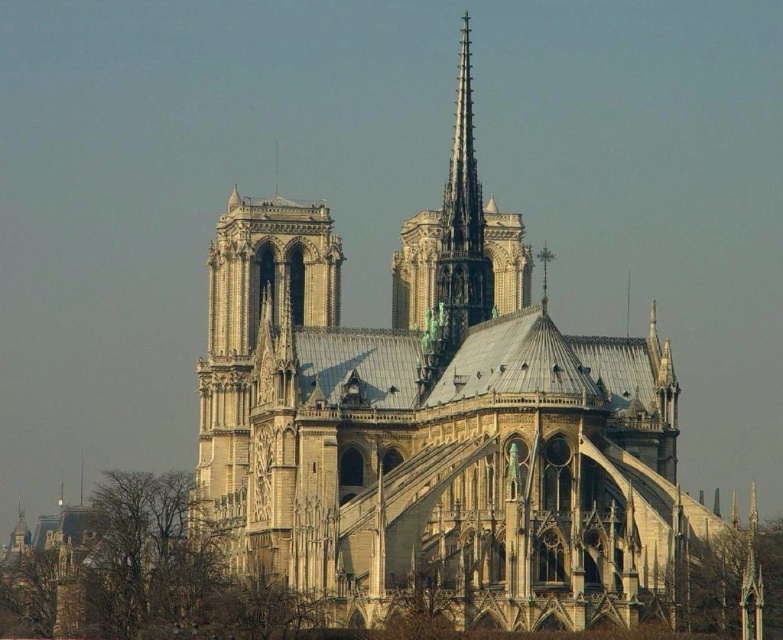
Based on the provided scene description, what are the coordinates of the stone church at center?

The stone church at center is located at coordinates point (435, 426).

You are standing in front of the stone church at center. If you want to take a photo of the entire structure without any cropping, what is the minimum distance you should maintain from the church?

The stone church at center and camera are 88.08 meters apart from each other. Therefore, to capture the entire structure without cropping, you should maintain a minimum distance of 88.08 meters from the stone church at center.